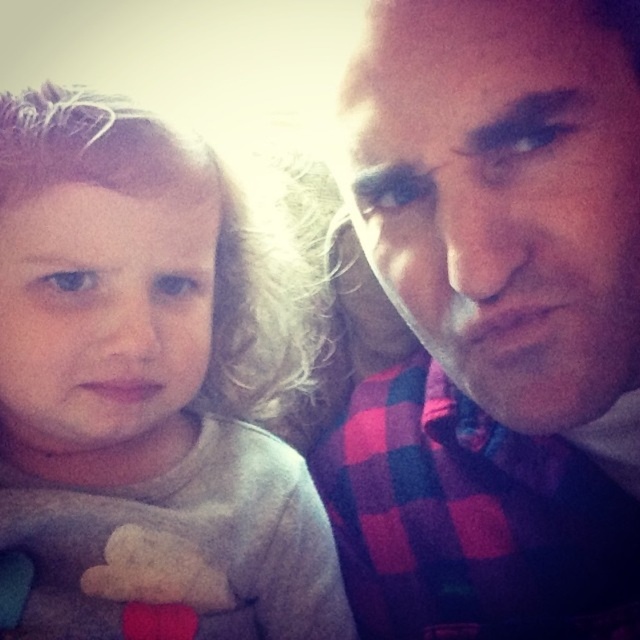
Who is higher up, plaid fabric shirt at right or gray soft fabric at left?

gray soft fabric at left is above.

Is point (381, 244) closer to camera compared to point (164, 148)?

Yes, it is.

The image size is (640, 640). I want to click on plaid fabric shirt at right, so click(497, 323).